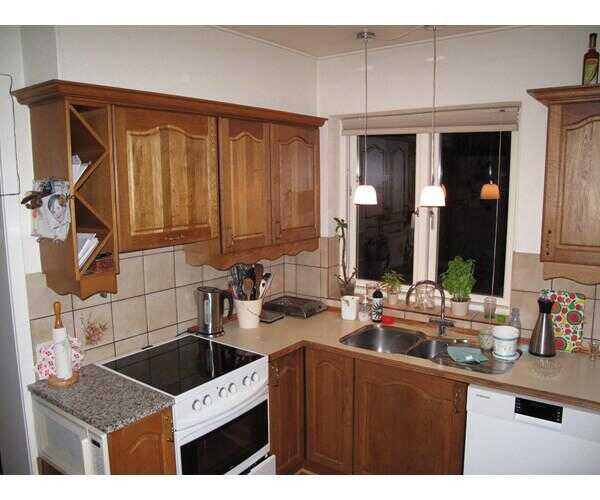
Identify the location of tile backsplash, off light brown. (x=291, y=268).